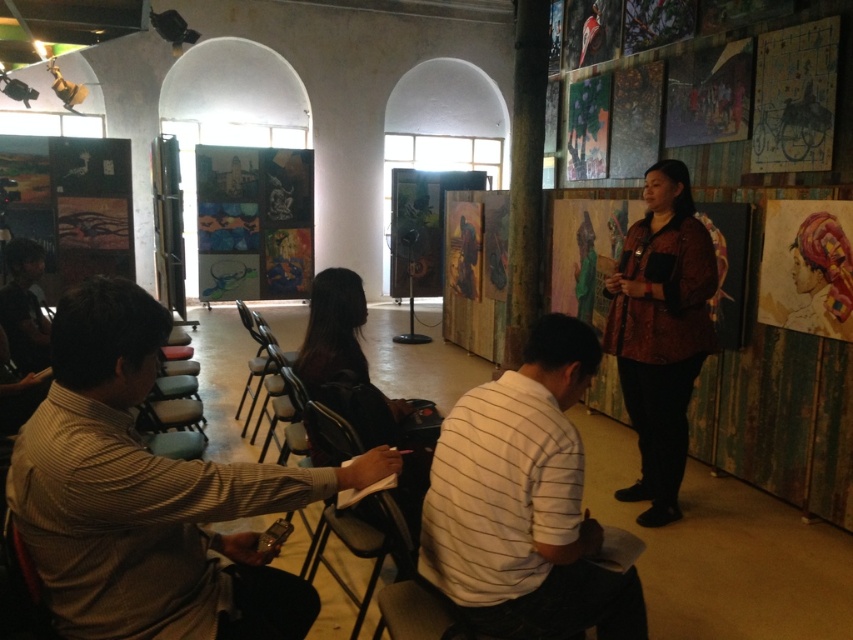
Who is higher up, light brown striped shirt at lower left or white striped shirt at center?

light brown striped shirt at lower left is above.

Looking at this image, can you confirm if light brown striped shirt at lower left is positioned below white striped shirt at center?

Actually, light brown striped shirt at lower left is above white striped shirt at center.

Identify the location of light brown striped shirt at lower left. (149, 496).

Between point (45, 449) and point (618, 346), which one is positioned in front?

Positioned in front is point (45, 449).

Is point (85, 481) closer to viewer compared to point (648, 250)?

Yes, point (85, 481) is in front of point (648, 250).

Where is `light brown striped shirt at lower left`? This screenshot has height=640, width=853. light brown striped shirt at lower left is located at coordinates (149, 496).

Who is shorter, white striped shirt at center or printed silk blouse at center?

Standing shorter between the two is white striped shirt at center.

Is white striped shirt at center wider than printed silk blouse at center?

Yes, white striped shirt at center is wider than printed silk blouse at center.

Between point (613, 627) and point (614, 324), which one is positioned in front?

Point (613, 627) is in front.

Identify the location of white striped shirt at center. The width and height of the screenshot is (853, 640). (524, 502).